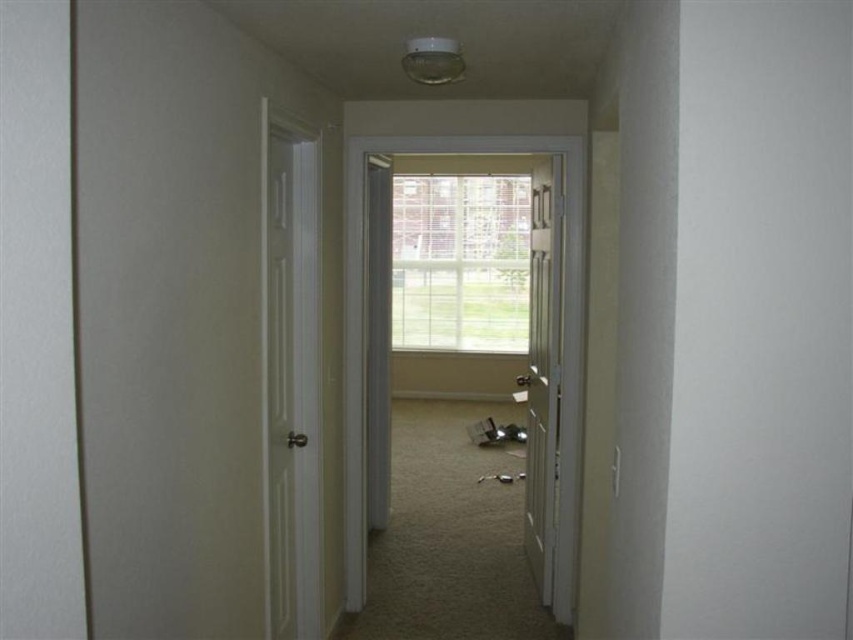
Between clear glass window at center and white wood door at center, which one has less height?

With less height is clear glass window at center.

Between clear glass window at center and white wood door at center, which one is positioned lower?

white wood door at center

Measure the distance between clear glass window at center and camera.

clear glass window at center is 23.62 feet from camera.

You are a GUI agent. You are given a task and a screenshot of the screen. Output one action in this format:
    pyautogui.click(x=<x>, y=<y>)
    Task: Click on the clear glass window at center
    
    Given the screenshot: What is the action you would take?
    pyautogui.click(x=460, y=262)

The image size is (853, 640). What do you see at coordinates (291, 372) in the screenshot?
I see `white smooth door at left` at bounding box center [291, 372].

Is white smooth door at left further to the viewer compared to clear glass window at center?

No, it is in front of clear glass window at center.

Is point (314, 406) positioned behind point (392, 202)?

No, (314, 406) is in front of (392, 202).

Where is `white smooth door at left`? This screenshot has width=853, height=640. white smooth door at left is located at coordinates (291, 372).

Between white smooth door at left and white wood door at center, which one appears on the right side from the viewer's perspective?

white wood door at center is more to the right.

Does white smooth door at left appear on the left side of white wood door at center?

Yes, white smooth door at left is to the left of white wood door at center.

Between point (270, 349) and point (550, 385), which one is positioned in front?

Point (270, 349)

I want to click on white smooth door at left, so click(291, 372).